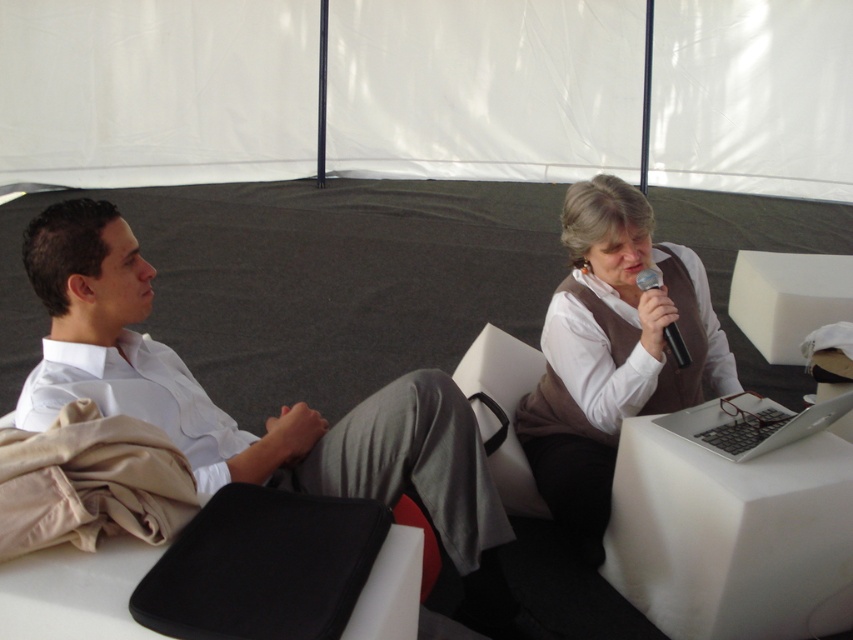
Question: Is silver metallic laptop at lower right positioned behind black plastic microphone at upper right?

Choices:
 (A) no
 (B) yes

Answer: (A)

Question: Does matte brown vest at upper right appear over black plastic microphone at upper right?

Choices:
 (A) yes
 (B) no

Answer: (B)

Question: Can you confirm if white smooth shirt at left is thinner than silver metallic laptop at lower right?

Choices:
 (A) yes
 (B) no

Answer: (B)

Question: Among these points, which one is farthest from the camera?

Choices:
 (A) coord(247,433)
 (B) coord(677,360)
 (C) coord(693,429)

Answer: (A)

Question: Which object is positioned closest to the black plastic microphone at upper right?

Choices:
 (A) matte brown vest at upper right
 (B) white smooth shirt at left

Answer: (A)

Question: Which point appears closest to the camera in this image?

Choices:
 (A) (685, 365)
 (B) (84, 355)
 (C) (814, 406)
 (D) (680, 262)

Answer: (B)